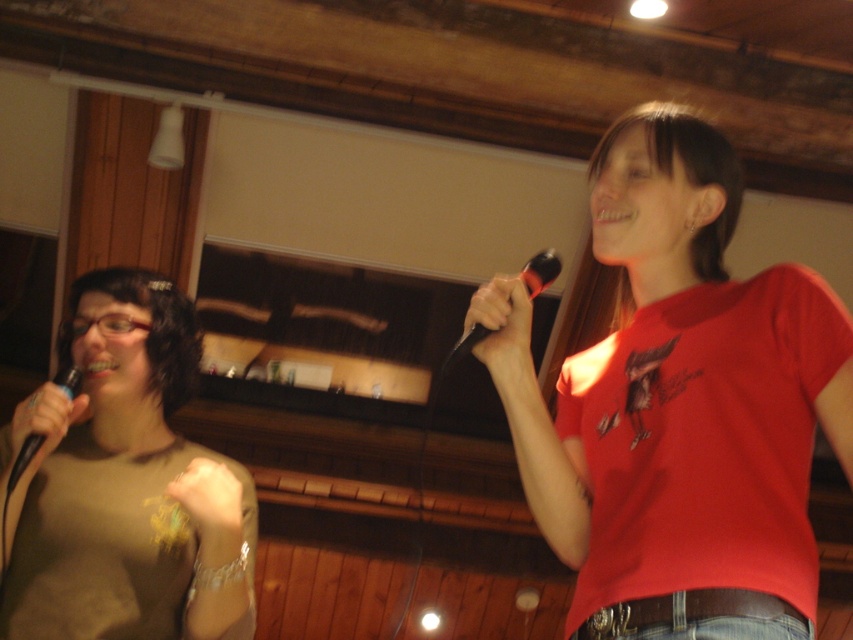
Can you confirm if matte brown shirt at left is thinner than matte black microphone at left?

No, matte brown shirt at left is not thinner than matte black microphone at left.

Can you confirm if matte brown shirt at left is positioned to the left of matte black microphone at left?

In fact, matte brown shirt at left is to the right of matte black microphone at left.

Between point (119, 317) and point (78, 372), which one is positioned in front?

Point (78, 372) is in front.

The height and width of the screenshot is (640, 853). In order to click on matte brown shirt at left in this screenshot , I will do `click(125, 483)`.

Is point (161, 509) positioned after point (474, 333)?

That is True.

Which is behind, point (154, 512) or point (450, 349)?

The point (450, 349) is behind.

Where is `matte brown shirt at left`? The image size is (853, 640). matte brown shirt at left is located at coordinates (125, 483).

Does red matte shirt at center have a smaller size compared to matte brown shirt at left?

Actually, red matte shirt at center might be larger than matte brown shirt at left.

Is red matte shirt at center positioned in front of matte brown shirt at left?

Yes, red matte shirt at center is in front of matte brown shirt at left.

Is point (598, 209) less distant than point (16, 413)?

That is True.

Locate an element on the screen. This screenshot has width=853, height=640. red matte shirt at center is located at coordinates (677, 404).